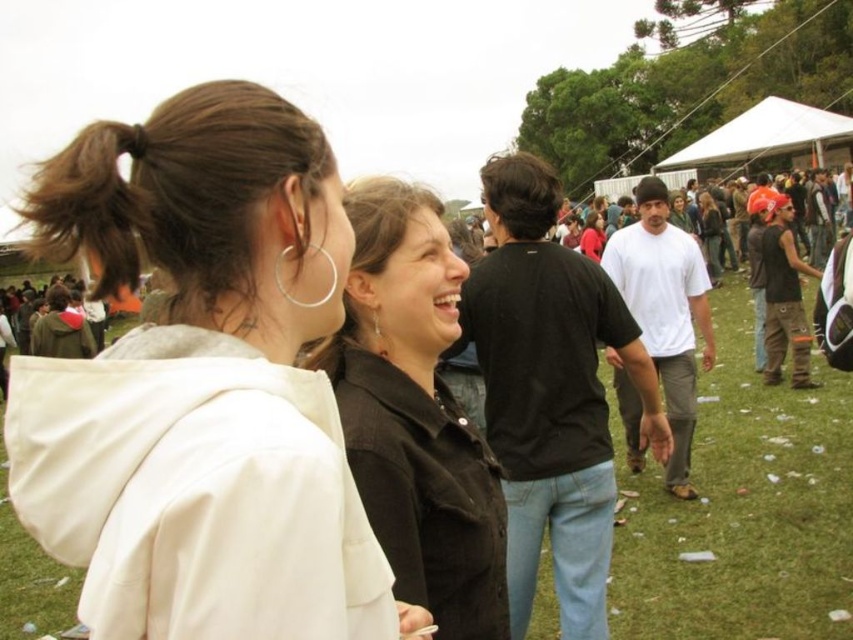
You are a photographer positioned at the center of the field. You need to capture a photo of the white matte jacket at upper left. According to the scene description, where should you aim your camera to ensure the jacket is in the frame?

The white matte jacket at upper left is located at point [202,385], so you should aim your camera towards the upper left direction to capture it within the frame.

You are organizing a photo shoot and need to ensure that the clothing items in the image are arranged by size from largest to smallest. Given the white matte jacket at upper left and the black matte shirt at center, which should come first in this arrangement?

The white matte jacket at upper left should come first in the arrangement since its width is larger than the black matte shirt at center.